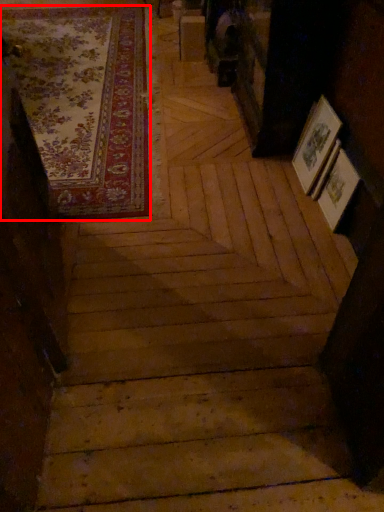
Question: From the image's perspective, where is mat (annotated by the red box) located in relation to stairwell in the image?

Choices:
 (A) above
 (B) below

Answer: (A)